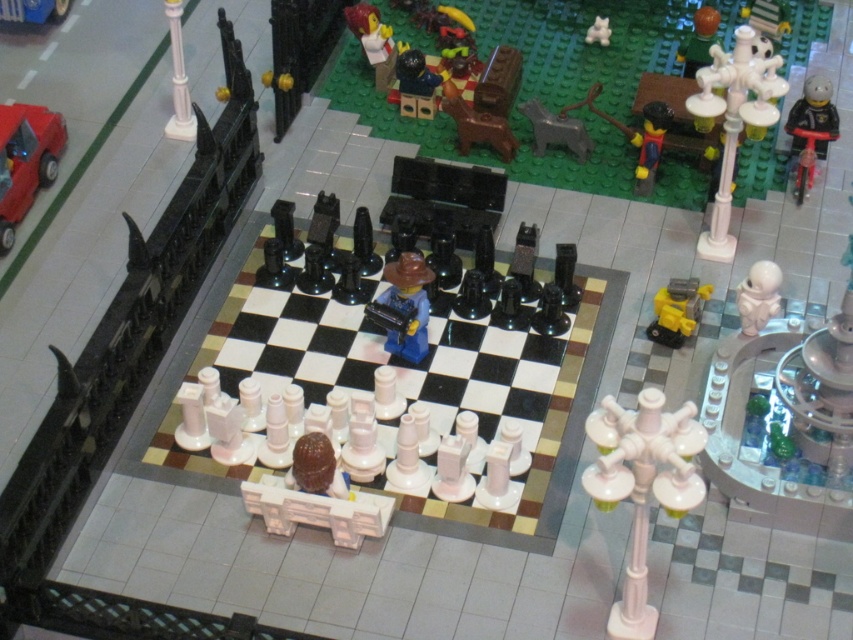
You are a Lego figure trying to retrieve the brown matte egg at center from under the smooth brown chess piece at upper center. Can you easily access it?

The brown matte egg at center is positioned under the smooth brown chess piece at upper center, so it might be difficult to access without moving the chess piece first.

You are a Lego figure positioned at point (596, 36). You want to move to point (55, 141). Based on the scene description, is the destination point in front of or behind your current position?

The point (55, 141) is in front of point (596, 36), so the destination is in front of your current position.